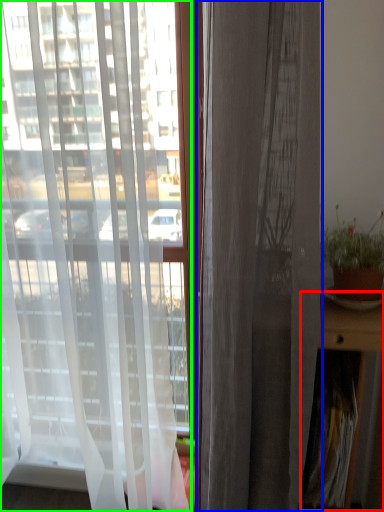
Question: Which object is the closest to the table (highlighted by a red box)? Choose among these: curtain (highlighted by a blue box) or curtain (highlighted by a green box).

Choices:
 (A) curtain
 (B) curtain

Answer: (A)